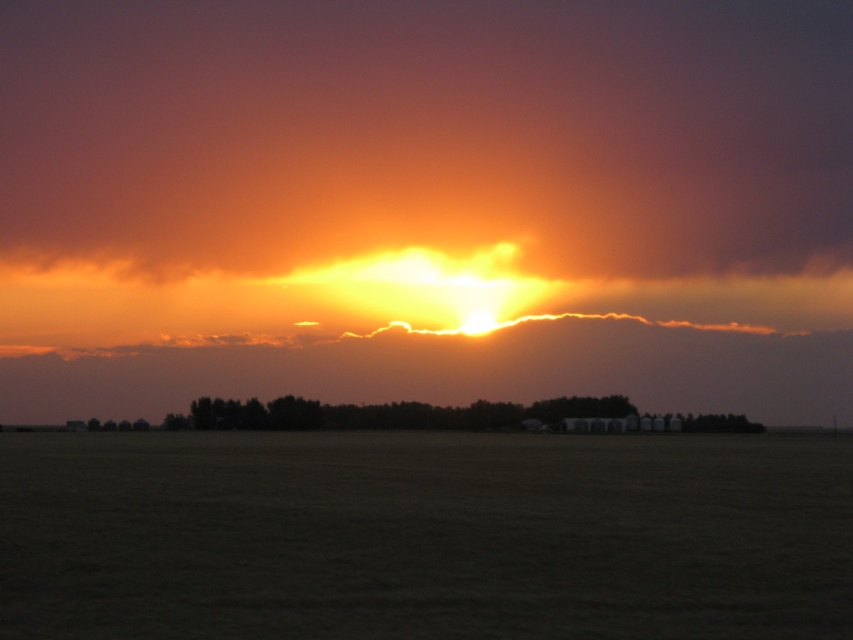
You are a photographer trying to capture the sunset. You notice the dark brown grass at center and the cloudy orange sky at center. Which object would appear closer to the camera if both are in focus? Please explain your reasoning based on their positions in the scene.

The dark brown grass at center would appear closer to the camera because it is positioned lower in the image, while the cloudy orange sky at center is higher up, typically indicating distance in such landscapes.

You are standing in a field at sunset and notice the dark brown grass at center and the cloudy orange sky at center. Which object is located below the other?

The dark brown grass at center is positioned under cloudy orange sky at center, so the dark brown grass is below the sky.